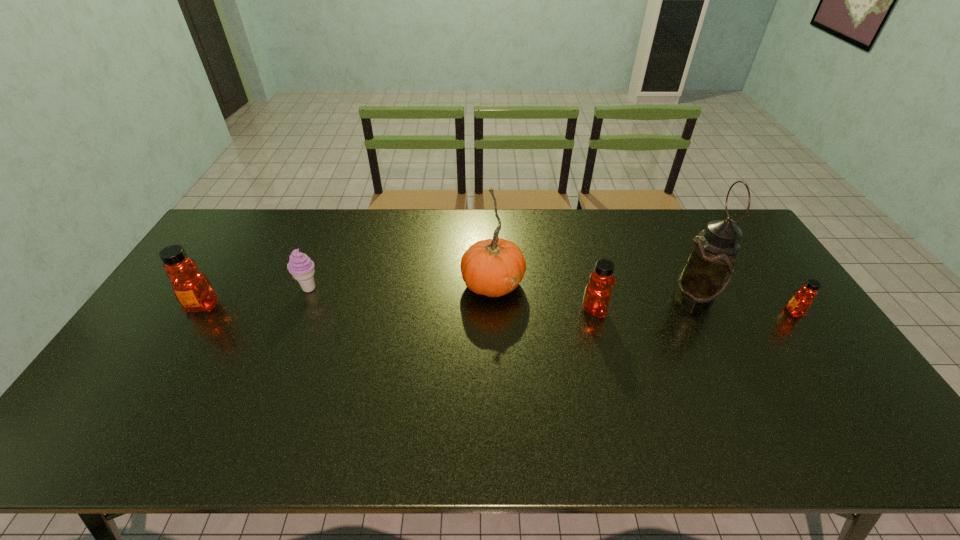
Locate an element on the screen. vacant space at the far edge of the desktop is located at coordinates (541, 211).

The image size is (960, 540). In the image, there is a desktop. Identify the location of vacant space at the near edge. (596, 381).

In the image, there is a desktop. Identify the location of free space at the far right corner. (695, 220).

You are a GUI agent. You are given a task and a screenshot of the screen. Output one action in this format:
    pyautogui.click(x=<x>, y=<y>)
    Task: Click on the vacant area that lies between the pumpkin and the second object from left to right
    
    Given the screenshot: What is the action you would take?
    pyautogui.click(x=401, y=286)

Where is `vacant region between the second object from left to right and the leftmost honey`? The height and width of the screenshot is (540, 960). vacant region between the second object from left to right and the leftmost honey is located at coordinates (256, 298).

Locate an element on the screen. The width and height of the screenshot is (960, 540). empty location between the shortest object and the fifth object from right to left is located at coordinates (552, 300).

The height and width of the screenshot is (540, 960). I want to click on empty space between the second shortest honey and the leftmost object, so click(398, 308).

Find the location of a particular element. vacant point located between the fifth object from right to left and the shortest honey is located at coordinates (552, 300).

Find the location of a particular element. vacant space that is in between the second tallest object and the shortest honey is located at coordinates (643, 298).

You are a GUI agent. You are given a task and a screenshot of the screen. Output one action in this format:
    pyautogui.click(x=<x>, y=<y>)
    Task: Click on the empty space that is in between the icecream and the second tallest object
    This screenshot has height=540, width=960.
    Given the screenshot: What is the action you would take?
    pyautogui.click(x=401, y=286)